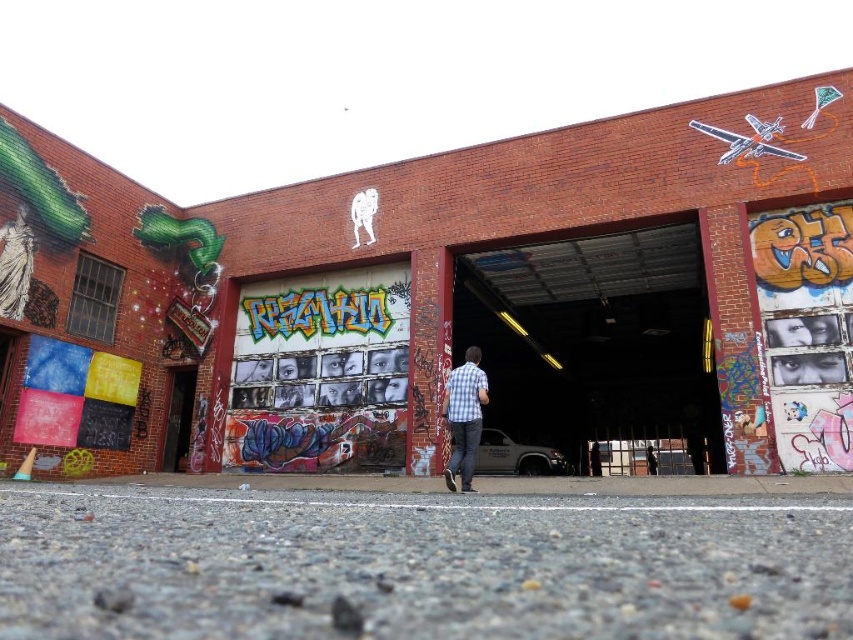
Does gray asphalt at lower center have a greater width compared to checkered shirt at center?

Yes.

Which is in front, point (554, 595) or point (473, 352)?

Point (554, 595)

The height and width of the screenshot is (640, 853). Describe the element at coordinates (428, 556) in the screenshot. I see `gray asphalt at lower center` at that location.

In order to click on gray asphalt at lower center in this screenshot , I will do `click(428, 556)`.